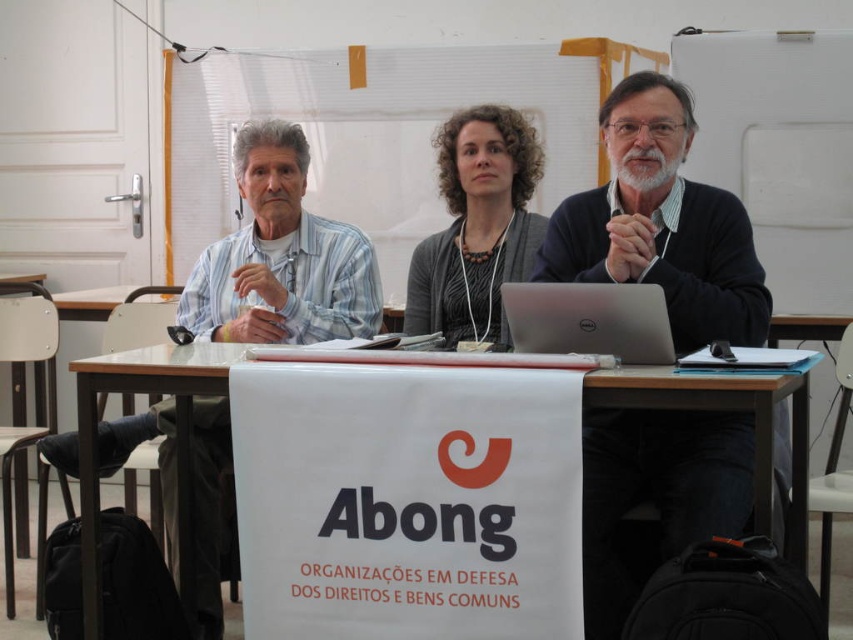
You are organizing a photo shoot and need to ensure that all items fit within a rectangular backdrop. The backdrop is exactly the same width as the silver metallic laptop at center. Will the light blue striped shirt at left fit within this backdrop?

The light blue striped shirt at left might be wider than the silver metallic laptop at center, so there is a possibility it may not fit within the backdrop that is the same width as the laptop.

Looking at this image, you are standing at the center of the room facing the table with the banner. There are two points marked on the table surface. The first point is at coordinates point (370,253) and the second is at point (646,294). If you want to place an object on the table such that it is closer to you, which point should you choose?

You should choose point (370,253) because it is behind point (646,294), meaning it is closer to your position at the center of the room facing the table.

You are a tailor measuring clothing for alterations. You see the light blue striped shirt at left and the dark gray sweater at center. Which garment has a larger width that might require more fabric for alterations?

The light blue striped shirt at left has a larger width than the dark gray sweater at center, so it would require more fabric for alterations.